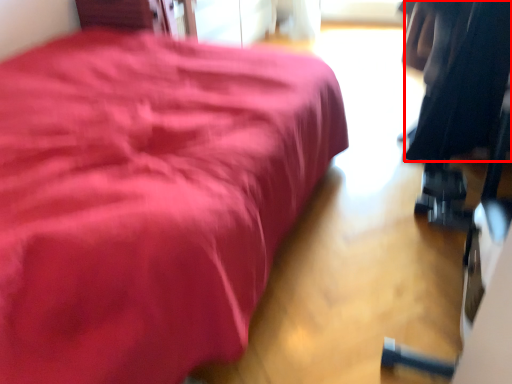
Question: From the image, what is the correct spatial relationship of clothing (annotated by the red box) in relation to furniture?

Choices:
 (A) right
 (B) left

Answer: (A)